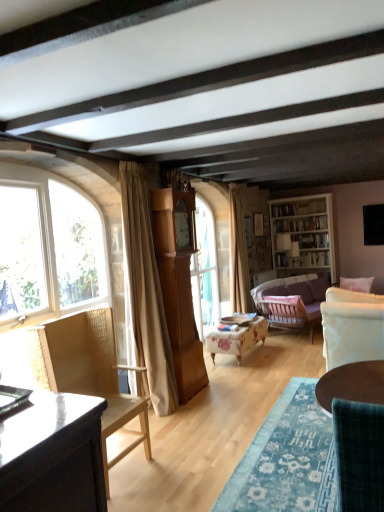
The height and width of the screenshot is (512, 384). In order to click on unoccupied region to the right of light brown wood grandfather clock at center in this screenshot , I will do `click(222, 391)`.